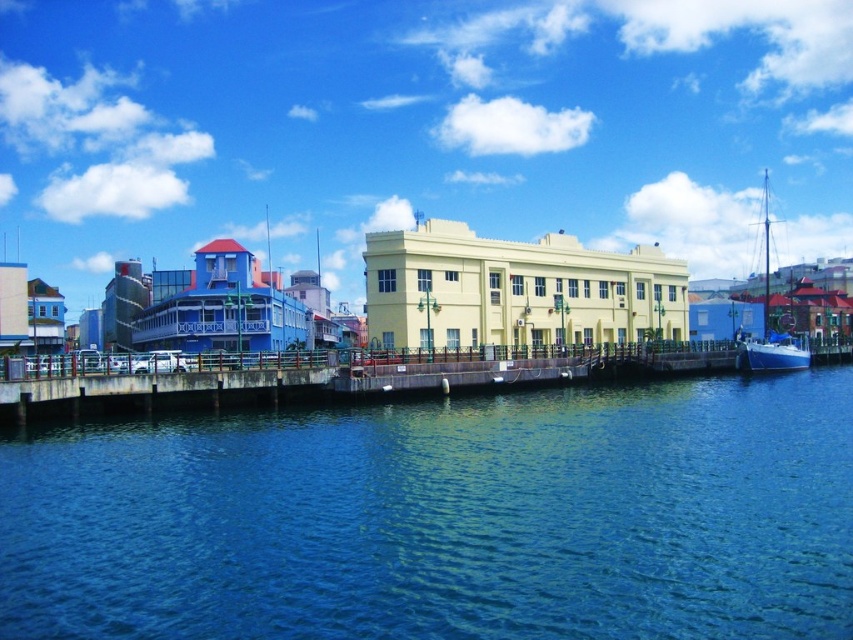
Question: Is blue water at lower center to the left of blue matte sailboat at right from the viewer's perspective?

Choices:
 (A) no
 (B) yes

Answer: (B)

Question: Is blue water at lower center closer to the viewer compared to blue matte sailboat at right?

Choices:
 (A) yes
 (B) no

Answer: (A)

Question: Is blue water at lower center to the right of blue matte sailboat at right from the viewer's perspective?

Choices:
 (A) yes
 (B) no

Answer: (B)